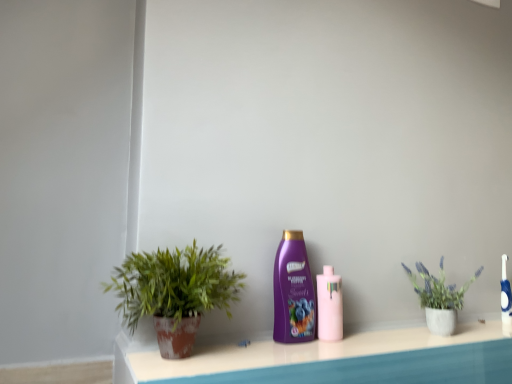
Question: From a real-world perspective, is purple glossy shampoo at center, the 1th bottle when ordered from left to right, physically located above or below green matte plant pot at left, the first houseplant in the left-to-right sequence?

Choices:
 (A) above
 (B) below

Answer: (A)

Question: Based on their sizes in the image, would you say purple glossy shampoo at center, placed as the second bottle when sorted from right to left, is bigger or smaller than green matte plant pot at left, the first houseplant in the left-to-right sequence?

Choices:
 (A) small
 (B) big

Answer: (A)

Question: Considering the real-world distances, which object is farthest from the pink glossy bottle at center, the first bottle viewed from the right?

Choices:
 (A) blue glossy toothbrush at right
 (B) matte concrete pot at right, arranged as the 2th houseplant when viewed from the front
 (C) purple glossy shampoo at center, the 1th bottle when ordered from left to right
 (D) green matte plant pot at left, which is the 1th houseplant in front-to-back order

Answer: (A)

Question: Based on their relative distances, which object is nearer to the blue glossy toothbrush at right?

Choices:
 (A) green matte plant pot at left, the first houseplant in the left-to-right sequence
 (B) purple glossy shampoo at center, placed as the second bottle when sorted from right to left
 (C) pink glossy bottle at center, the first bottle viewed from the right
 (D) matte concrete pot at right, which is the second houseplant in left-to-right order

Answer: (D)